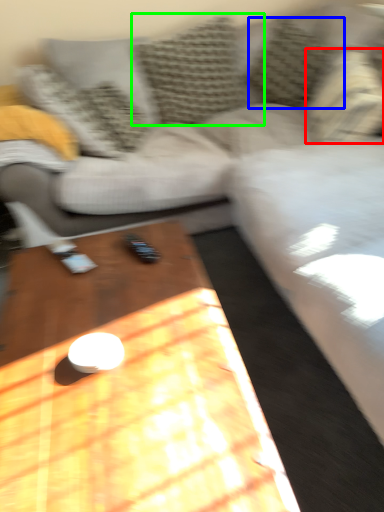
Question: Which object is the farthest from pillow (highlighted by a red box)? Choose among these: pillow (highlighted by a blue box) or pillow (highlighted by a green box).

Choices:
 (A) pillow
 (B) pillow

Answer: (B)